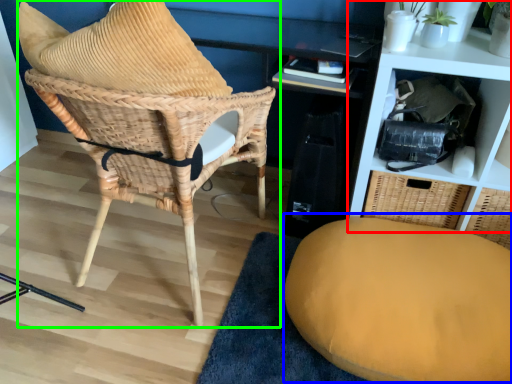
Question: Based on their relative distances, which object is nearer to shelf (highlighted by a red box)? Choose from swivel chair (highlighted by a blue box) and chair (highlighted by a green box).

Choices:
 (A) swivel chair
 (B) chair

Answer: (A)